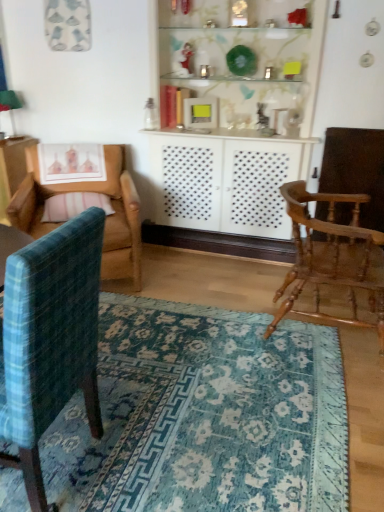
Question: Can you confirm if wooden rocking chair at right, placed as the third chair when sorted from left to right, is smaller than blue woven rug at lower center?

Choices:
 (A) yes
 (B) no

Answer: (B)

Question: Can you confirm if wooden rocking chair at right, the 1th chair positioned from the right, is thinner than blue woven rug at lower center?

Choices:
 (A) no
 (B) yes

Answer: (B)

Question: Can you confirm if wooden rocking chair at right, the 1th chair positioned from the right, is taller than blue woven rug at lower center?

Choices:
 (A) yes
 (B) no

Answer: (A)

Question: From the image's perspective, is wooden rocking chair at right, placed as the third chair when sorted from left to right, beneath blue woven rug at lower center?

Choices:
 (A) yes
 (B) no

Answer: (B)

Question: Is wooden rocking chair at right, placed as the third chair when sorted from left to right, located outside blue woven rug at lower center?

Choices:
 (A) no
 (B) yes

Answer: (B)

Question: Is point (49, 202) positioned closer to the camera than point (306, 279)?

Choices:
 (A) farther
 (B) closer

Answer: (A)

Question: From the image's perspective, is pink striped pillow at left above or below wooden rocking chair at right, the 1th chair positioned from the right?

Choices:
 (A) above
 (B) below

Answer: (A)

Question: Is pink striped pillow at left situated inside wooden rocking chair at right, placed as the third chair when sorted from left to right, or outside?

Choices:
 (A) outside
 (B) inside

Answer: (A)

Question: In terms of width, does pink striped pillow at left look wider or thinner when compared to wooden rocking chair at right, the 1th chair positioned from the right?

Choices:
 (A) thin
 (B) wide

Answer: (A)

Question: From the image's perspective, relative to wooden armchair at left, the third chair viewed from the right, is blue woven rug at lower center above or below?

Choices:
 (A) below
 (B) above

Answer: (A)

Question: From a real-world perspective, is blue woven rug at lower center physically located above or below wooden armchair at left, acting as the first chair starting from the left?

Choices:
 (A) above
 (B) below

Answer: (B)

Question: In terms of width, does blue woven rug at lower center look wider or thinner when compared to wooden armchair at left, the third chair viewed from the right?

Choices:
 (A) wide
 (B) thin

Answer: (A)

Question: Is blue woven rug at lower center spatially inside wooden armchair at left, the third chair viewed from the right, or outside of it?

Choices:
 (A) outside
 (B) inside

Answer: (A)

Question: In terms of height, does teal plaid chair at left, which is the second chair in right-to-left order, look taller or shorter compared to blue woven rug at lower center?

Choices:
 (A) tall
 (B) short

Answer: (A)

Question: Based on their sizes in the image, would you say teal plaid chair at left, which is the second chair in right-to-left order, is bigger or smaller than blue woven rug at lower center?

Choices:
 (A) small
 (B) big

Answer: (B)